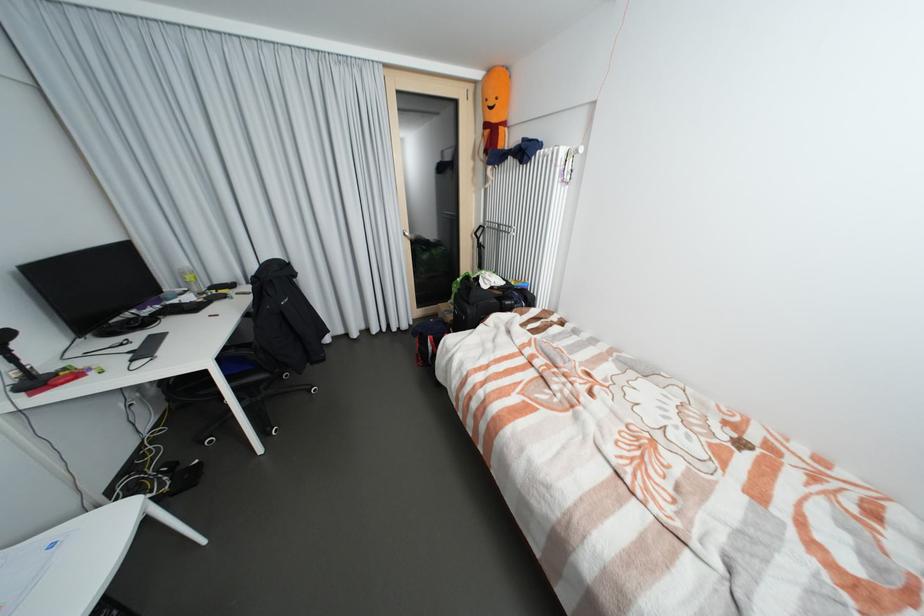
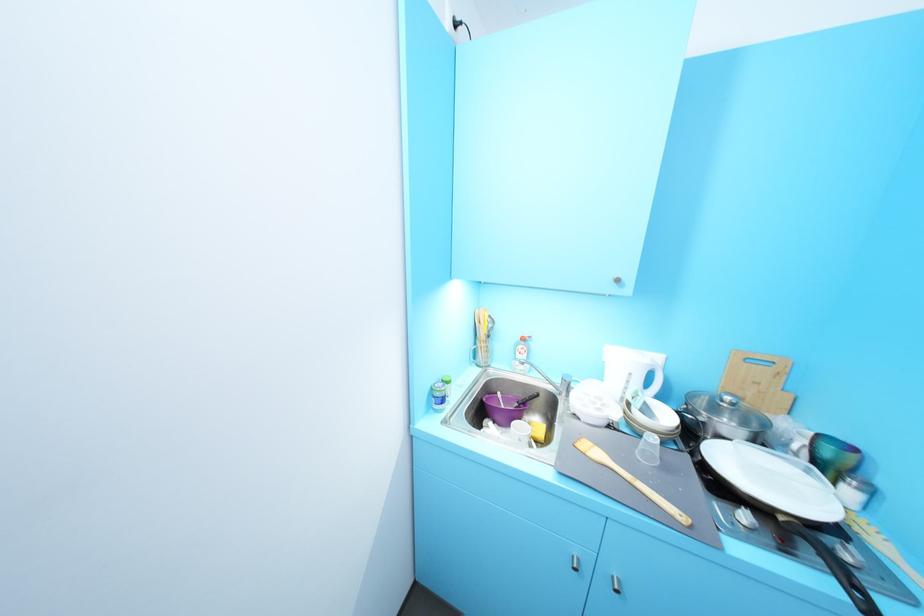
Question: I am providing you with two images of the same scene from different viewpoints. Please identify which objects are invisible in image2.

Choices:
 (A) purple bowl
 (B) wooden spatula
 (C) silver thermos bottle
 (D) orange stuffed toy

Answer: (D)